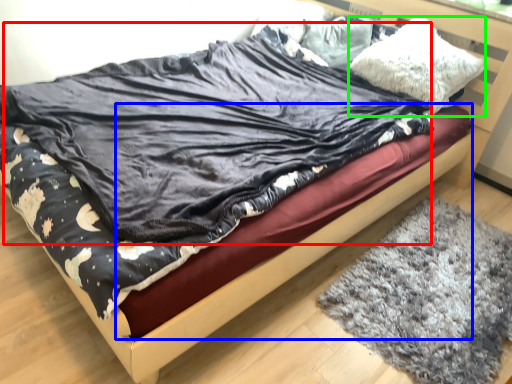
Question: Considering the real-world distances, which object is closest to blanket (highlighted by a red box)? bed frame (highlighted by a blue box) or pillow (highlighted by a green box).

Choices:
 (A) bed frame
 (B) pillow

Answer: (A)